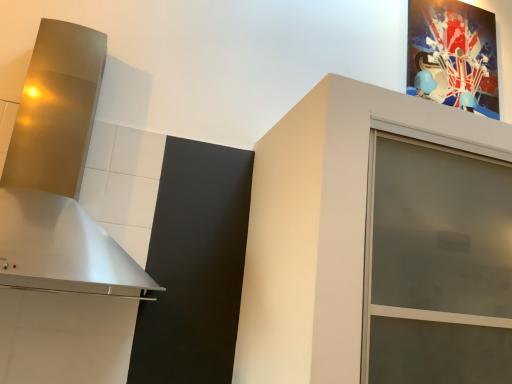
Question: Is frosted glass cabinet at upper right spatially inside metallic silver vent at left, or outside of it?

Choices:
 (A) inside
 (B) outside

Answer: (B)

Question: Based on their sizes in the image, would you say frosted glass cabinet at upper right is bigger or smaller than metallic silver vent at left?

Choices:
 (A) small
 (B) big

Answer: (B)

Question: Which of these objects is positioned farthest from the metallic silver vent at left?

Choices:
 (A) metallic glossy picture frame at upper right
 (B) frosted glass cabinet at upper right

Answer: (A)

Question: Which object is the farthest from the metallic glossy picture frame at upper right?

Choices:
 (A) metallic silver vent at left
 (B) frosted glass cabinet at upper right

Answer: (A)